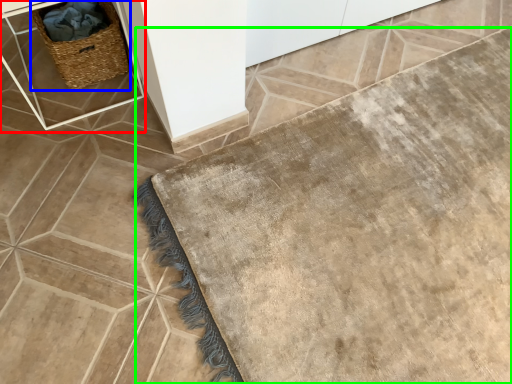
Question: Which object is positioned farthest from table (highlighted by a red box)? Select from picnic basket (highlighted by a blue box) and bath mat (highlighted by a green box).

Choices:
 (A) picnic basket
 (B) bath mat

Answer: (B)